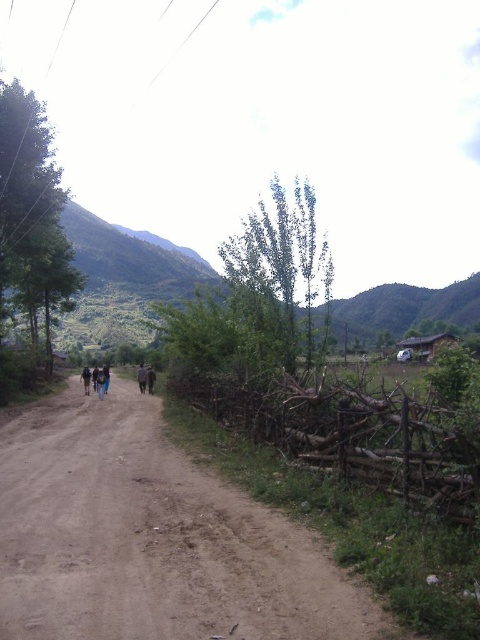
Question: Considering the relative positions of green grassy mountain at upper left and dark blue jeans at center in the image provided, where is green grassy mountain at upper left located with respect to dark blue jeans at center?

Choices:
 (A) left
 (B) right

Answer: (B)

Question: Which point appears farthest from the camera in this image?

Choices:
 (A) (144, 380)
 (B) (370, 314)
 (C) (338, 577)
 (D) (84, 384)

Answer: (B)

Question: Does brown dirt track at center appear on the right side of dark brown leather jacket at center?

Choices:
 (A) no
 (B) yes

Answer: (B)

Question: Among these points, which one is nearest to the camera?

Choices:
 (A) (84, 388)
 (B) (463, 284)
 (C) (131, 566)

Answer: (C)

Question: Which of these objects is positioned farthest from the dark blue jeans at center?

Choices:
 (A) brown dirt track at center
 (B) green grassy mountain at upper left

Answer: (B)

Question: Does dark blue jeans at center have a larger size compared to dark brown leather jacket at center?

Choices:
 (A) no
 (B) yes

Answer: (A)